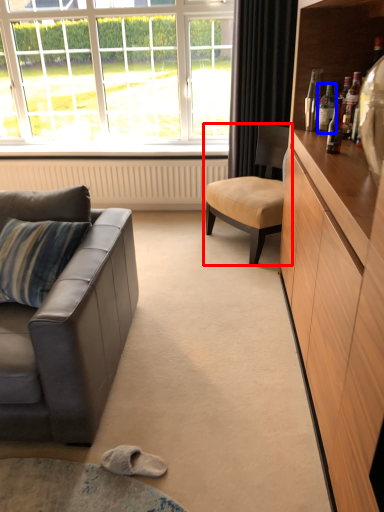
Question: Among these objects, which one is nearest to the camera, chair (highlighted by a red box) or bottle (highlighted by a blue box)?

Choices:
 (A) chair
 (B) bottle

Answer: (B)